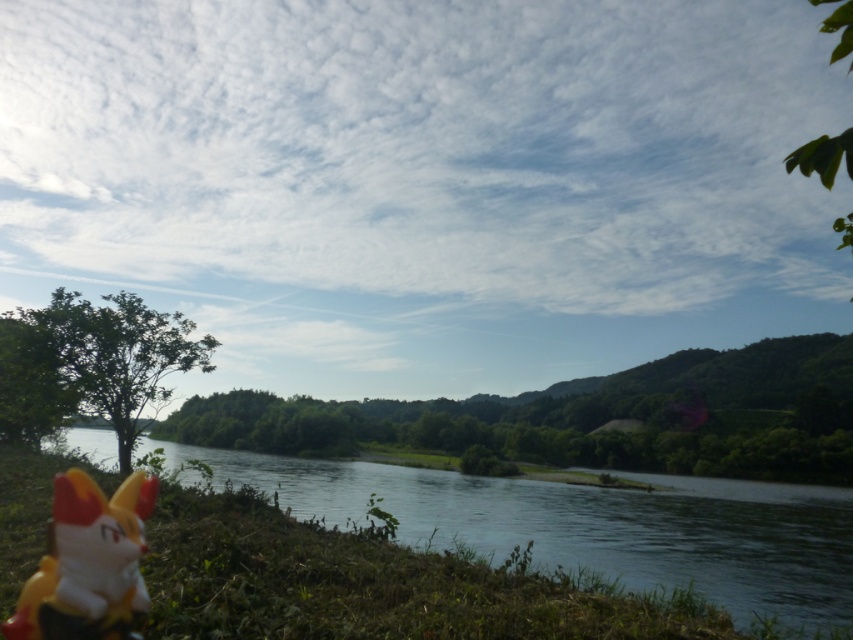
You are a photographer standing at the grassy bank. You want to take a photo of the clear water at river left and the yellow plastic toy at lower left. Which object should be placed closer to the camera to ensure both are in focus?

The yellow plastic toy at lower left is behind clear water at river left, so to ensure both are in focus, the photographer should place the clear water at river left closer to the camera.

You are standing at the yellow plastic toy at lower left and want to throw a stone to the clear water at river left. Can you reach it with a single throw if the maximum throwing distance you can achieve is 25 meters?

The distance between the clear water at river left and the yellow plastic toy at lower left is 25.81 meters, which exceeds your maximum throwing distance of 25 meters. Therefore, you cannot reach it with a single throw.

You are an artist planning to paint the scene. You need to place the clear water at river left in your painting. Where should you position it on your canvas using a coordinate system from 0 to 1 in both x and y axes?

You should position the clear water at river left at the coordinate point of 0.822 on the x axis and 0.696 on the y axis.